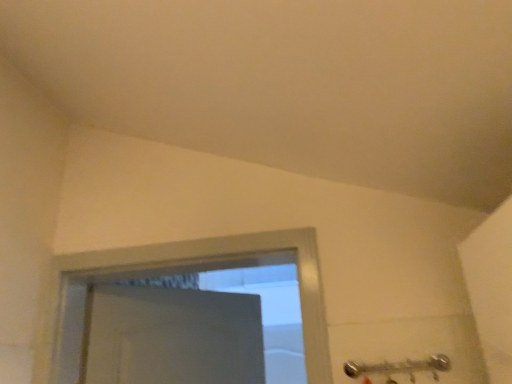
What do you see at coordinates (400, 367) in the screenshot? I see `satin nickel shower at lower right` at bounding box center [400, 367].

This screenshot has height=384, width=512. In order to click on satin nickel shower at lower right in this screenshot , I will do `click(400, 367)`.

The width and height of the screenshot is (512, 384). Find the location of `satin nickel shower at lower right`. satin nickel shower at lower right is located at coordinates (400, 367).